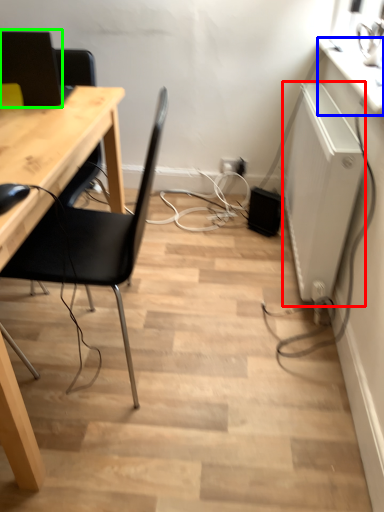
Question: Considering the real-world distances, which object is closest to appliance (highlighted by a red box)? counter top (highlighted by a blue box) or computer monitor (highlighted by a green box).

Choices:
 (A) counter top
 (B) computer monitor

Answer: (A)